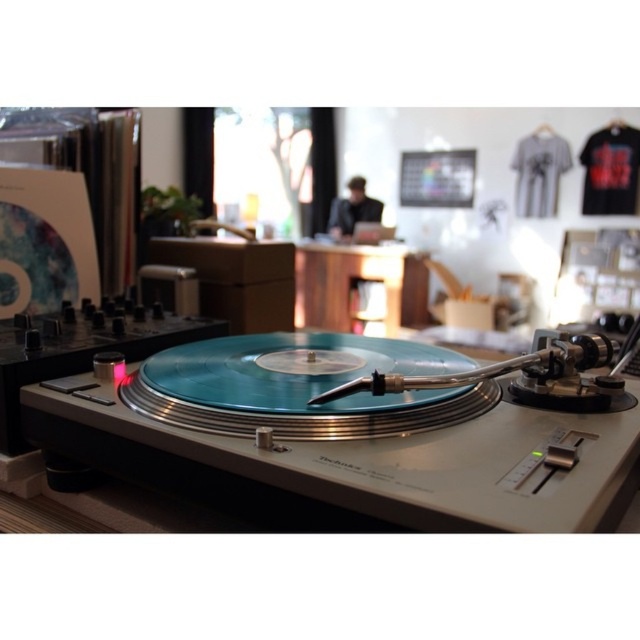
Question: Which object is positioned closest to the teal vinyl record player at center?

Choices:
 (A) wooden table at center
 (B) black fabric dj at center

Answer: (A)

Question: Does teal vinyl record player at center have a larger size compared to wooden table at center?

Choices:
 (A) yes
 (B) no

Answer: (B)

Question: Is teal vinyl record player at center below black fabric dj at center?

Choices:
 (A) yes
 (B) no

Answer: (A)

Question: Considering the relative positions of teal vinyl record player at center and wooden table at center in the image provided, where is teal vinyl record player at center located with respect to wooden table at center?

Choices:
 (A) left
 (B) right

Answer: (A)

Question: Estimate the real-world distances between objects in this image. Which object is farther from the teal vinyl record player at center?

Choices:
 (A) black fabric dj at center
 (B) wooden table at center

Answer: (A)

Question: Considering the real-world distances, which object is farthest from the teal vinyl record player at center?

Choices:
 (A) wooden table at center
 (B) black fabric dj at center

Answer: (B)